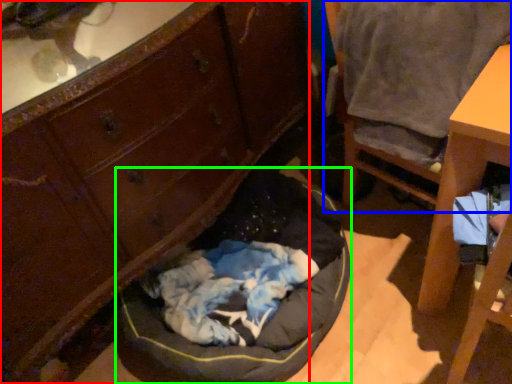
Question: Which object is the closest to the cabinetry (highlighted by a red box)? Choose among these: chair (highlighted by a blue box) or dog bed (highlighted by a green box).

Choices:
 (A) chair
 (B) dog bed

Answer: (B)